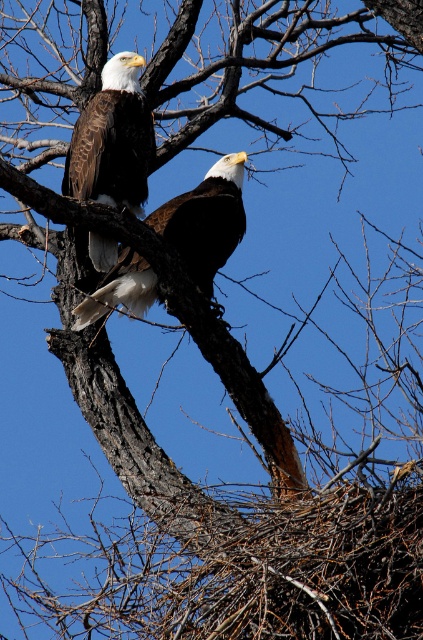
What do you see at coordinates (112, 140) in the screenshot? I see `brown feathered eagle at upper left` at bounding box center [112, 140].

Is point (140, 61) behind point (244, 225)?

Yes, it is behind point (244, 225).

Where is `brown feathered eagle at upper left`? This screenshot has width=423, height=640. brown feathered eagle at upper left is located at coordinates (112, 140).